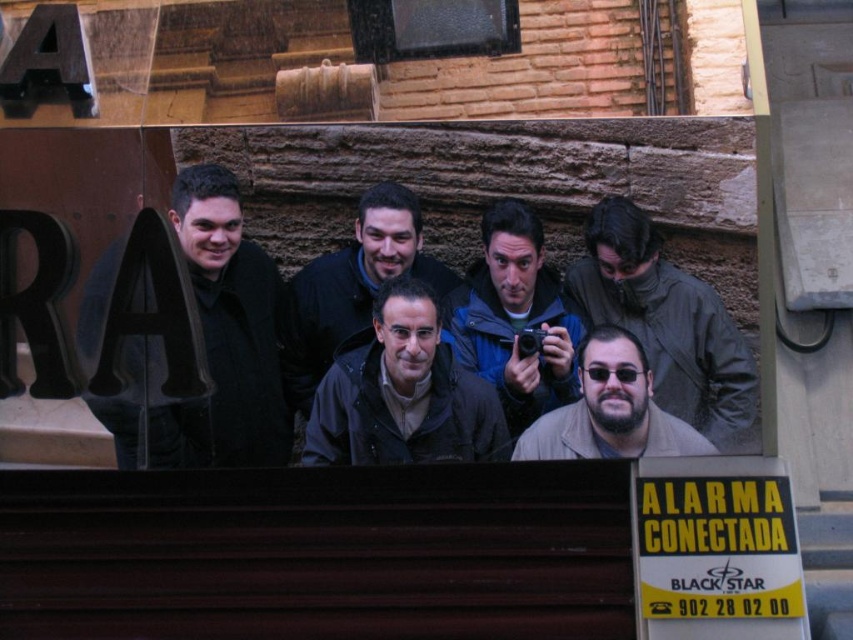
You are a photographer trying to capture a photo of the yellow paper sign at lower right and the beige fabric jacket at center. Which object is narrower in width?

The yellow paper sign at lower right is narrower in width than the beige fabric jacket at center.

You are a photographer standing in front of the building with the group. You need to decide which jacket to wear for the shoot based on the weather. The black matte jacket at left is larger than the blue jacket at center. Which jacket would provide better insulation against the cold?

The black matte jacket at left has a larger size compared to the blue jacket at center, so it would provide better insulation against the cold.

You are standing in front of the stone wall with the group and want to take a photo of both the dark blue jacket at center and the beige fabric jacket at center. Which jacket should you focus on first to ensure both are in clear view?

You should focus on the dark blue jacket at center first because it is closer to you than the beige fabric jacket at center, ensuring both are in clear view.